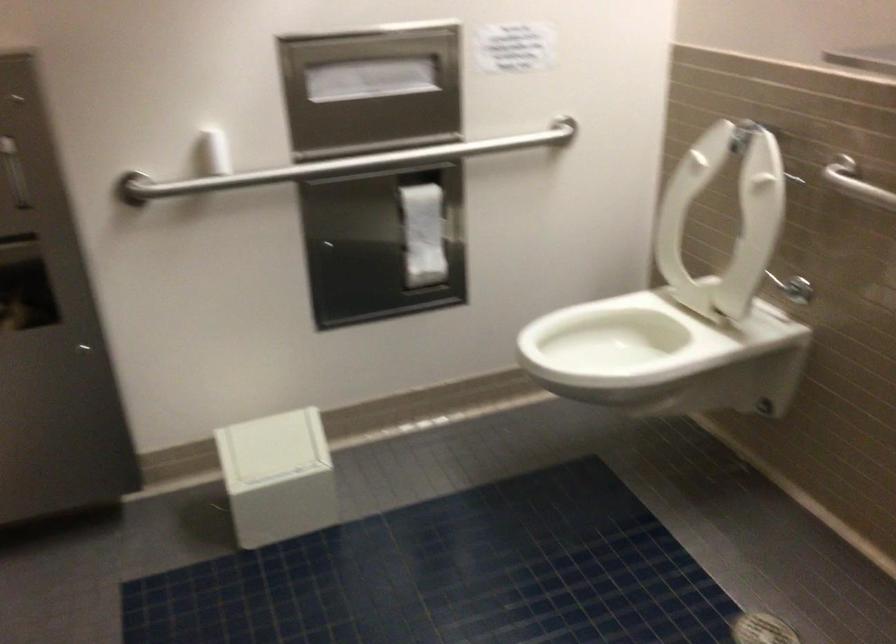
The height and width of the screenshot is (644, 896). What do you see at coordinates (278, 477) in the screenshot?
I see `a white bin lid` at bounding box center [278, 477].